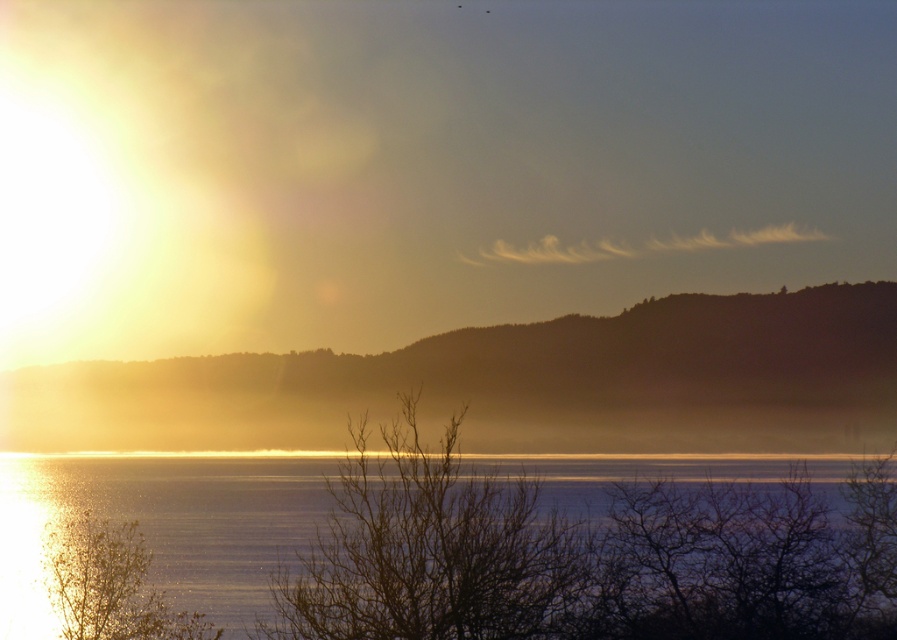
Question: Is glistening water at lower center wider than green matte tree at lower left?

Choices:
 (A) no
 (B) yes

Answer: (B)

Question: Does foggy horizon at center have a lesser width compared to brown/dry branches at center?

Choices:
 (A) no
 (B) yes

Answer: (A)

Question: Which object is the farthest from the green matte tree at lower left?

Choices:
 (A) brown/dry branches at center
 (B) glistening water at lower center

Answer: (A)

Question: Which object appears farthest from the camera in this image?

Choices:
 (A) foggy horizon at center
 (B) glistening water at lower center

Answer: (A)

Question: Which of the following is the farthest from the observer?

Choices:
 (A) brown/dry branches at center
 (B) glistening water at lower center
 (C) foggy horizon at center
 (D) green matte tree at lower left

Answer: (D)

Question: Can you confirm if foggy horizon at center is smaller than brown/dry branches at center?

Choices:
 (A) no
 (B) yes

Answer: (A)